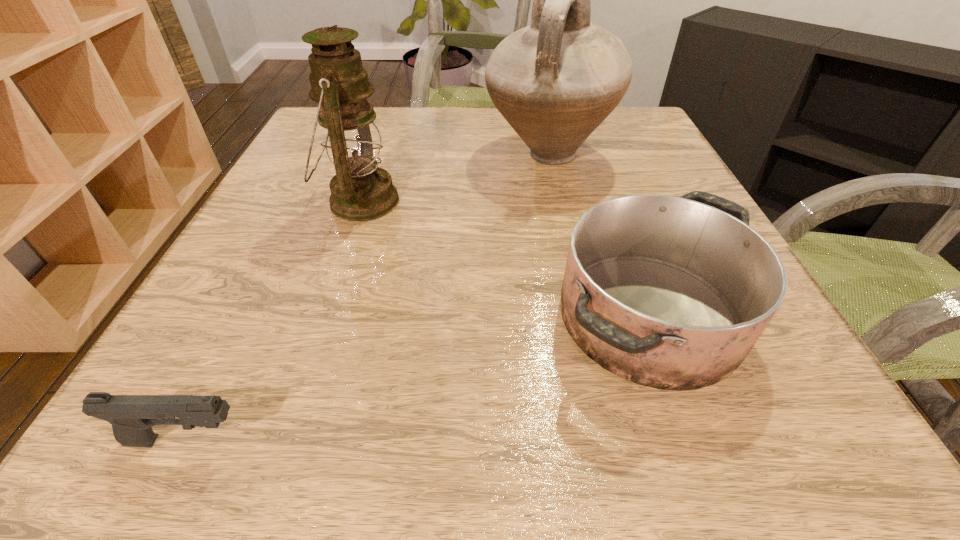
Where is `pitcher`? The image size is (960, 540). pitcher is located at coordinates (555, 81).

You are a GUI agent. You are given a task and a screenshot of the screen. Output one action in this format:
    pyautogui.click(x=<x>, y=<y>)
    Task: Click on the oil lamp
    The height and width of the screenshot is (540, 960).
    Given the screenshot: What is the action you would take?
    point(360,191)

The width and height of the screenshot is (960, 540). Find the location of `saucepan`. saucepan is located at coordinates (668, 292).

Where is `the third farthest object`? the third farthest object is located at coordinates (668, 292).

Image resolution: width=960 pixels, height=540 pixels. Identify the location of the nearest object. (132, 416).

Where is `pistol`? This screenshot has width=960, height=540. pistol is located at coordinates (132, 416).

This screenshot has width=960, height=540. What are the coordinates of `vacant area situated 0.330m on the handle side of the pitcher` in the screenshot? It's located at (583, 313).

The image size is (960, 540). Find the location of `vacant space situated 0.230m on the back of the oil lamp`. vacant space situated 0.230m on the back of the oil lamp is located at coordinates (387, 125).

Locate an element on the screen. Image resolution: width=960 pixels, height=540 pixels. vacant space located 0.220m on the back of the second nearest object is located at coordinates 600,181.

I want to click on free region located 0.170m at the barrel of the pistol, so click(x=394, y=441).